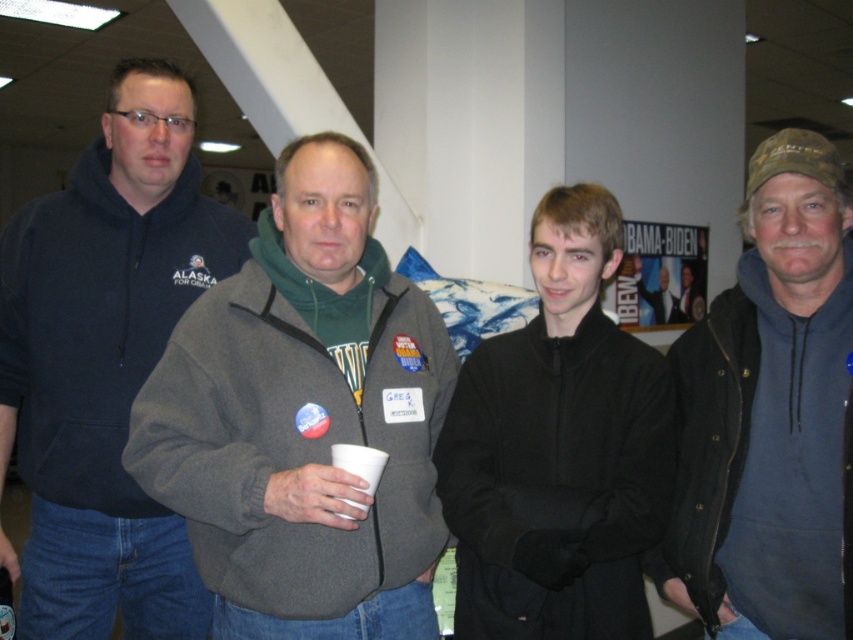
You are a photographer at this political event. You need to capture a photo that includes both the gray fleece jacket at center and the black fleece jacket at center. Which jacket should you ensure is positioned higher in the frame to avoid blocking the other?

The gray fleece jacket at center is much taller than the black fleece jacket at center. To avoid blocking, position the taller gray fleece jacket at center higher in the frame so the shorter black fleece jacket at center remains visible.

You are organizing a photo shoot and need to place two fleece jackets on a rack. The rack has a limited width. Based on the image, which fleece jacket, the gray fleece jacket at center or the blue fleece jacket at right, would you estimate to take up more space on the rack?

The gray fleece jacket at center is wider than the blue fleece jacket at right, so it would take up more space on the rack.

From the picture: You are a photographer at this event and want to capture a photo that includes both the dark blue fleece at left and the black fleece jacket at center. Which one should you focus on first to ensure both are in focus?

You should focus on the dark blue fleece at left first since it is closer to you than the black fleece jacket at center. By focusing on the closer object, the farther one will also be in focus due to depth of field.